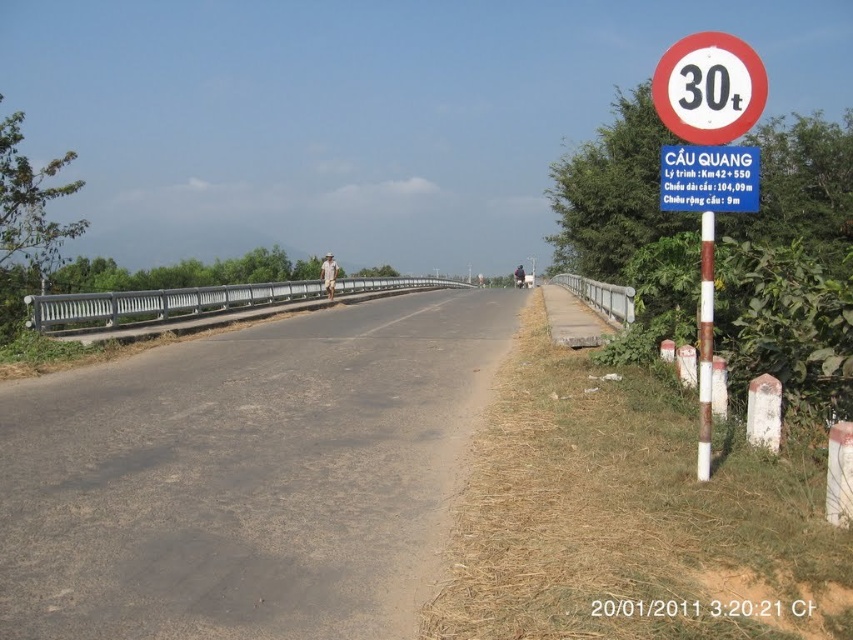
In the scene shown: You are a truck driver planning to cross the silver metallic bridge at center. There is a white plastic speed limit sign at upper right. Considering the distance between them, can your truck, which is 12 meters long, safely stop before reaching the bridge if you start braking from the sign?

The distance between the silver metallic bridge at center and the white plastic speed limit sign at upper right is 32.52 meters. Since the truck is 12 meters long, the remaining distance available for braking is 32.52 meters minus 12 meters, which equals 20.52 meters. This distance may be insufficient for a safe stop depending on speed and road conditions, so caution is advised.

You are a truck driver approaching the rural road scene. You need to cross the silver metallic bridge at center. According to the provided information, what is the maximum weight limit allowed for vehicles on this bridge?

The maximum weight limit for vehicles on the silver metallic bridge at center is 30 tons, as indicated by the red circular sign with white background displaying 30t.